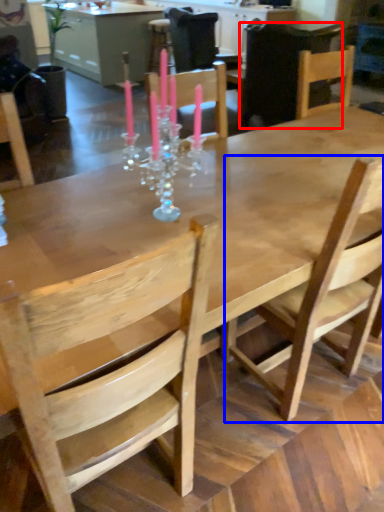
Question: Which object is closer to the camera taking this photo, chair (highlighted by a red box) or chair (highlighted by a blue box)?

Choices:
 (A) chair
 (B) chair

Answer: (B)